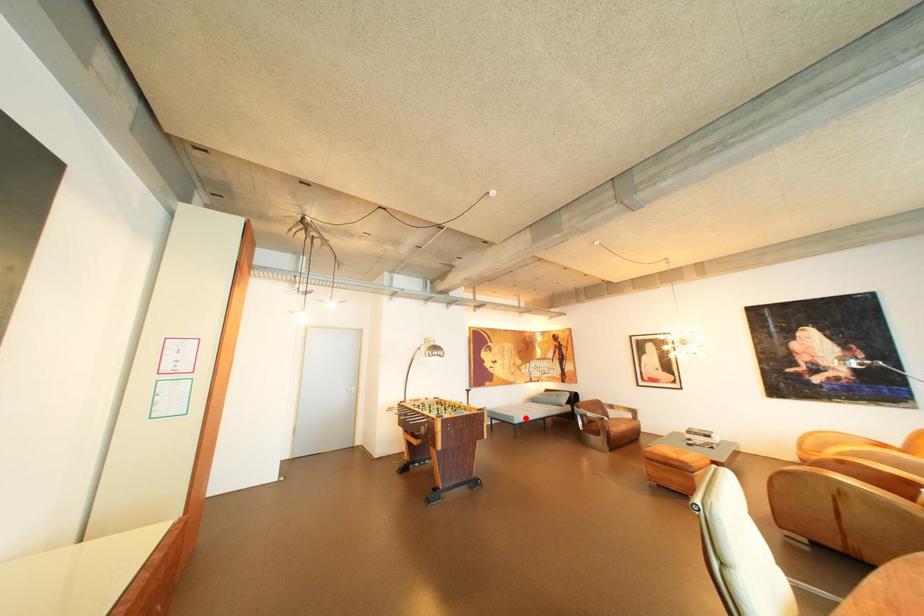
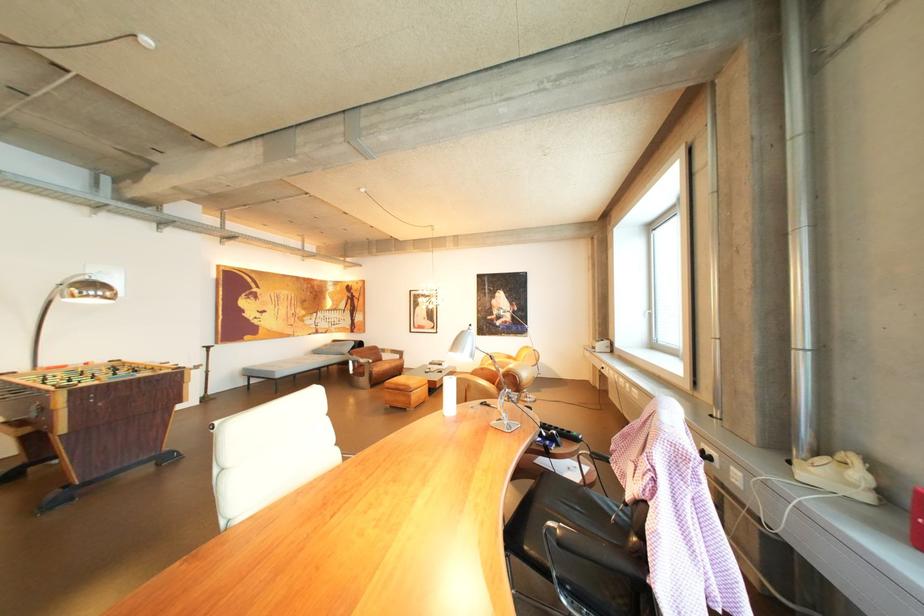
Question: I am providing you with two images of the same scene from different viewpoints. A red point is shown in image1. For the corresponding object point in image2, is it positioned nearer or farther from the camera?

Choices:
 (A) Nearer
 (B) Farther

Answer: (A)